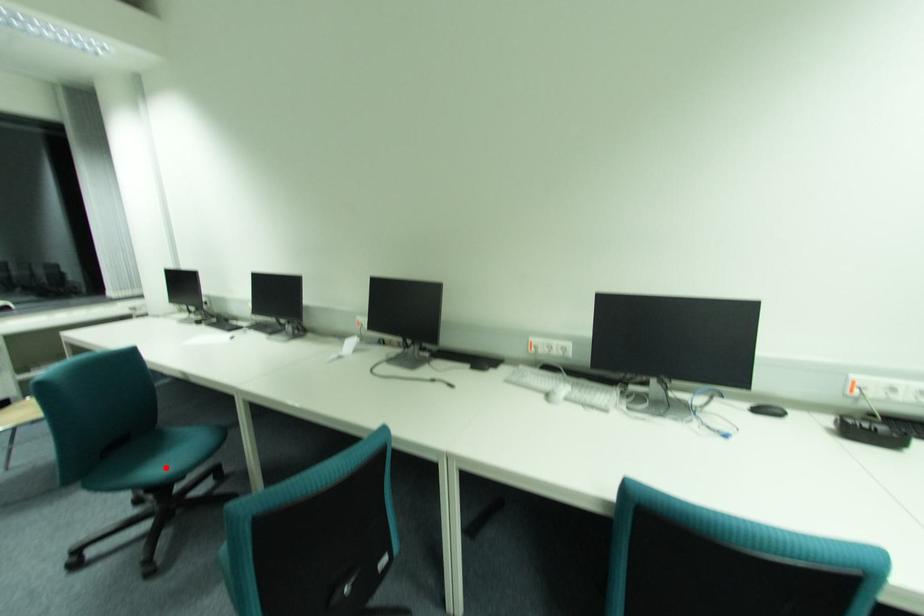
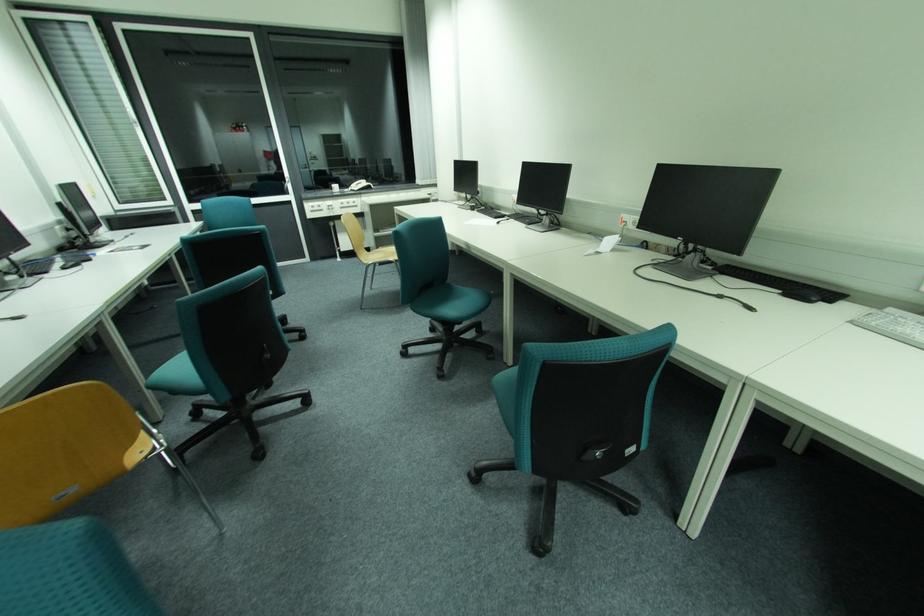
Locate, in the second image, the point that corresponds to the highlighted location in the first image.

(456, 310)